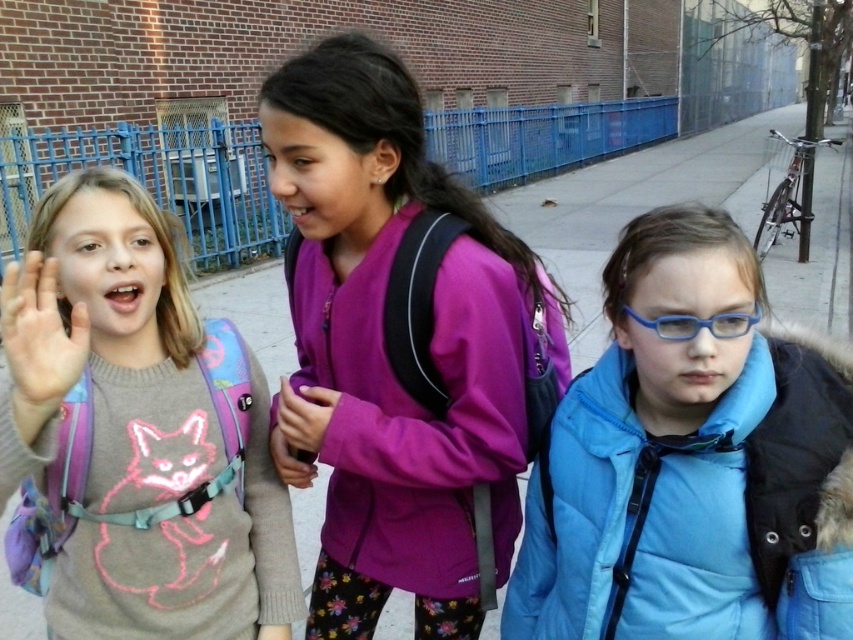
Question: Observing the image, what is the correct spatial positioning of matte pink sweater at center in reference to blue plastic glasses at center?

Choices:
 (A) left
 (B) right

Answer: (A)

Question: Can you confirm if purple fleece jacket at center is positioned to the right of matte pink sweater at center?

Choices:
 (A) no
 (B) yes

Answer: (B)

Question: Which object is positioned closest to the matte pink sweater at center?

Choices:
 (A) matte gray sweater at left
 (B) smooth skin hand at center left

Answer: (A)

Question: Which object appears farthest from the camera in this image?

Choices:
 (A) matte pink sweater at center
 (B) smooth skin hand at center left
 (C) purple fleece jacket at center

Answer: (A)

Question: Which point is farther to the camera?

Choices:
 (A) (142, 248)
 (B) (820, 592)
 (C) (329, 392)

Answer: (C)

Question: Can you confirm if blue matte jacket at center is bigger than blue plastic glasses at center?

Choices:
 (A) yes
 (B) no

Answer: (A)